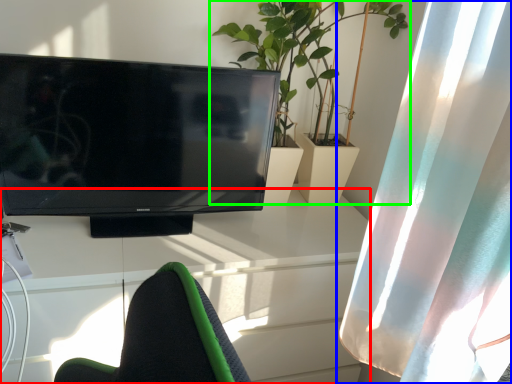
Question: Which object is the farthest from desk (highlighted by a red box)? Choose among these: curtain (highlighted by a blue box) or houseplant (highlighted by a green box).

Choices:
 (A) curtain
 (B) houseplant

Answer: (B)